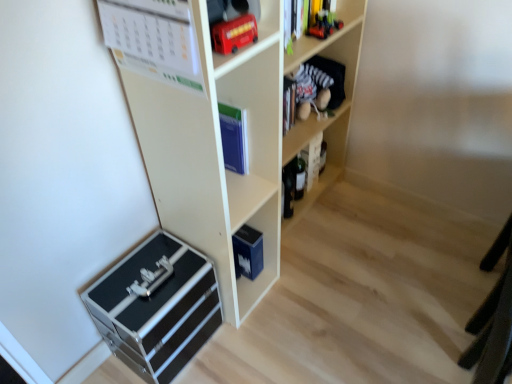
Question: Does metallic red bus at upper center, marked as the 1th toy in a bottom-to-top arrangement, come in front of blue matte book at center?

Choices:
 (A) no
 (B) yes

Answer: (B)

Question: Is metallic red bus at upper center, arranged as the 2th toy when viewed from the top, turned away from blue matte book at center?

Choices:
 (A) yes
 (B) no

Answer: (B)

Question: Is metallic red bus at upper center, the first toy viewed from the left, to the right of blue matte book at center from the viewer's perspective?

Choices:
 (A) no
 (B) yes

Answer: (B)

Question: Considering the relative positions of metallic red bus at upper center, the first toy in the front-to-back sequence, and blue matte book at center in the image provided, is metallic red bus at upper center, the first toy in the front-to-back sequence, to the left of blue matte book at center from the viewer's perspective?

Choices:
 (A) no
 (B) yes

Answer: (A)

Question: From the image's perspective, does metallic red bus at upper center, the first toy in the front-to-back sequence, appear higher than blue matte book at center?

Choices:
 (A) no
 (B) yes

Answer: (B)

Question: Is there a large distance between metallic red bus at upper center, arranged as the 2th toy when viewed from the top, and blue matte book at center?

Choices:
 (A) no
 (B) yes

Answer: (A)

Question: Considering the relative positions of velvet plush toy at upper right, the second shelf positioned from the top, and metallic red toy car at upper right, which appears as the 1th toy when viewed from the back, in the image provided, is velvet plush toy at upper right, the second shelf positioned from the top, in front of metallic red toy car at upper right, which appears as the 1th toy when viewed from the back,?

Choices:
 (A) no
 (B) yes

Answer: (A)

Question: Is velvet plush toy at upper right, the second shelf positioned from the top, positioned with its back to metallic red toy car at upper right, placed as the second toy when sorted from left to right?

Choices:
 (A) yes
 (B) no

Answer: (B)

Question: Is velvet plush toy at upper right, the second shelf positioned from the top, smaller than metallic red toy car at upper right, placed as the second toy when sorted from left to right?

Choices:
 (A) no
 (B) yes

Answer: (A)

Question: Is velvet plush toy at upper right, the second shelf positioned from the top, at the left side of metallic red toy car at upper right, placed as the second toy when sorted from left to right?

Choices:
 (A) yes
 (B) no

Answer: (A)

Question: Are velvet plush toy at upper right, which ranks as the third shelf in bottom-to-top order, and metallic red toy car at upper right, which appears as the 1th toy when viewed from the back, located far from each other?

Choices:
 (A) no
 (B) yes

Answer: (A)

Question: From a real-world perspective, is velvet plush toy at upper right, which ranks as the third shelf in bottom-to-top order, positioned under metallic red toy car at upper right, the 2th toy ordered from the bottom, based on gravity?

Choices:
 (A) no
 (B) yes

Answer: (B)

Question: From the image's perspective, does metallic red bus at upper center, which is counted as the 2th toy, starting from the back, appear higher than velvet plush toy at upper right, the second shelf positioned from the top?

Choices:
 (A) yes
 (B) no

Answer: (B)